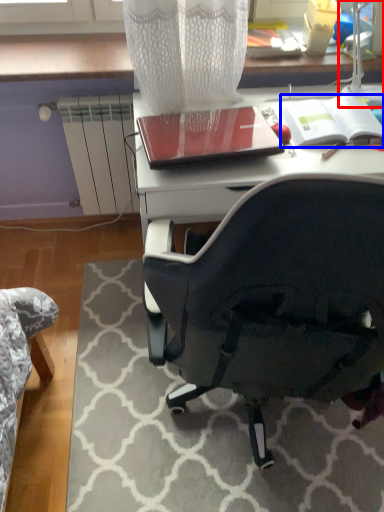
Question: Which object appears farthest to the camera in this image, table lamp (highlighted by a red box) or notebook (highlighted by a blue box)?

Choices:
 (A) table lamp
 (B) notebook

Answer: (B)